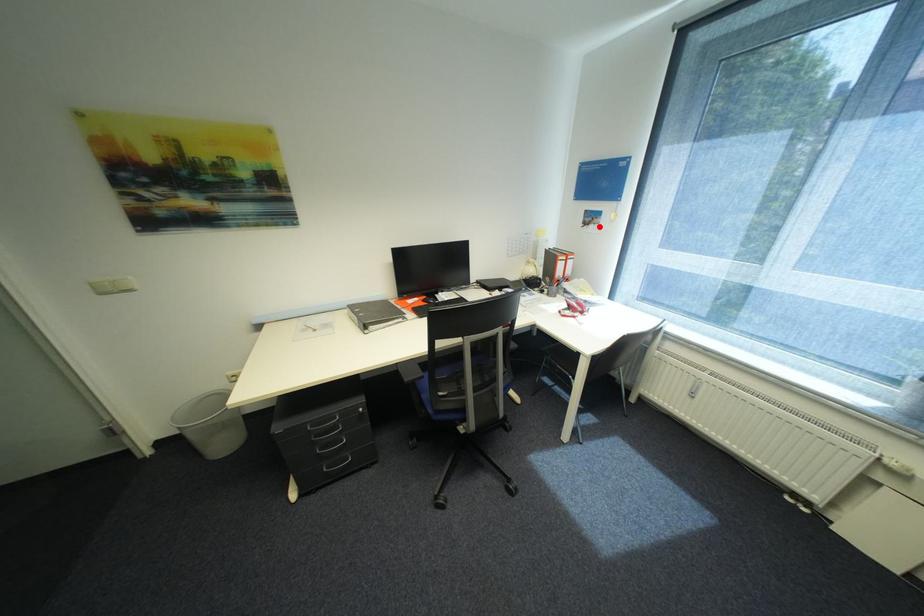
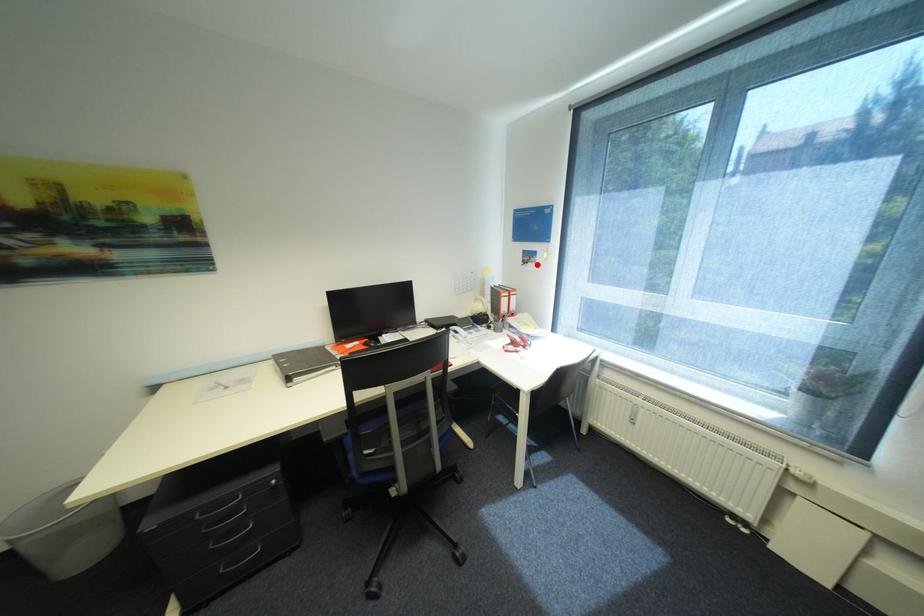
I am providing you with two images of the same scene from different viewpoints. A red point is marked on the first image and another point is marked on the second image. Is the red point in image1 aligned with the point shown in image2?

Yes